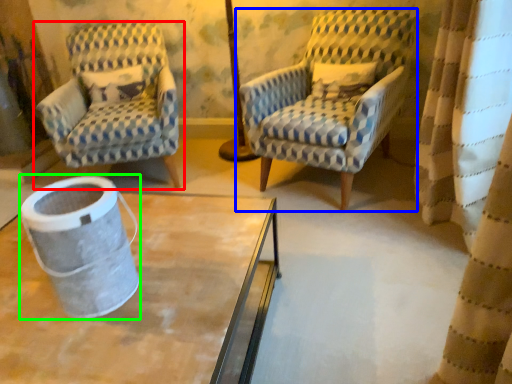
Question: Which object is positioned closest to chair (highlighted by a red box)? Select from chair (highlighted by a blue box) and gray (highlighted by a green box).

Choices:
 (A) chair
 (B) gray

Answer: (A)